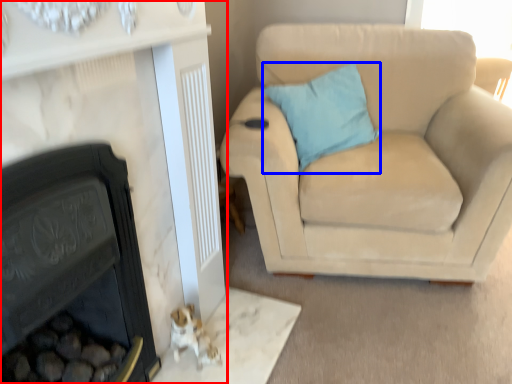
Question: Which object appears closest to the camera in this image, fireplace (highlighted by a red box) or pillow (highlighted by a blue box)?

Choices:
 (A) fireplace
 (B) pillow

Answer: (A)